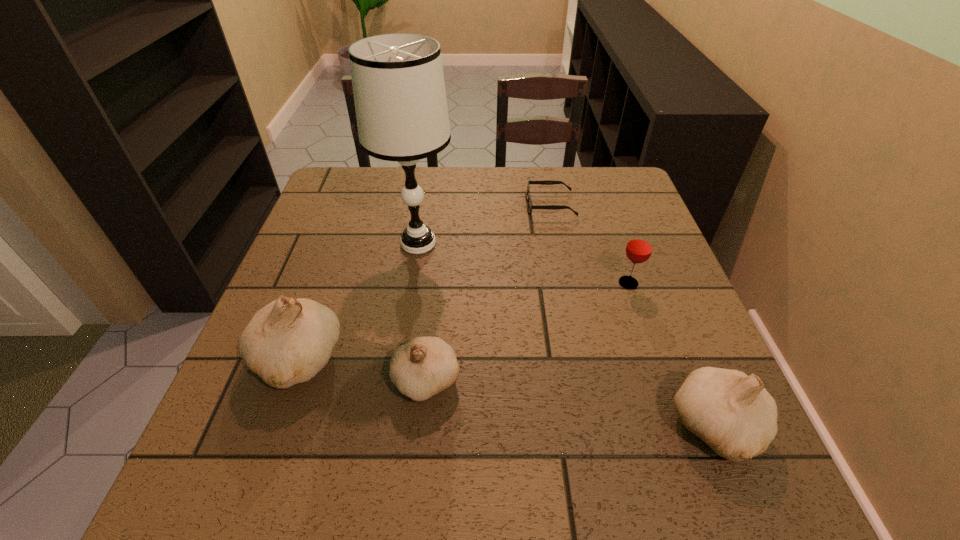
If the aim is uniform spacing by inserting an additional garlic among them, please point to a vacant space for this new garlic. Please provide its 2D coordinates. Your answer should be formatted as a tuple, i.e. [(x, y)], where the tuple contains the x and y coordinates of a point satisfying the conditions above.

[(564, 403)]